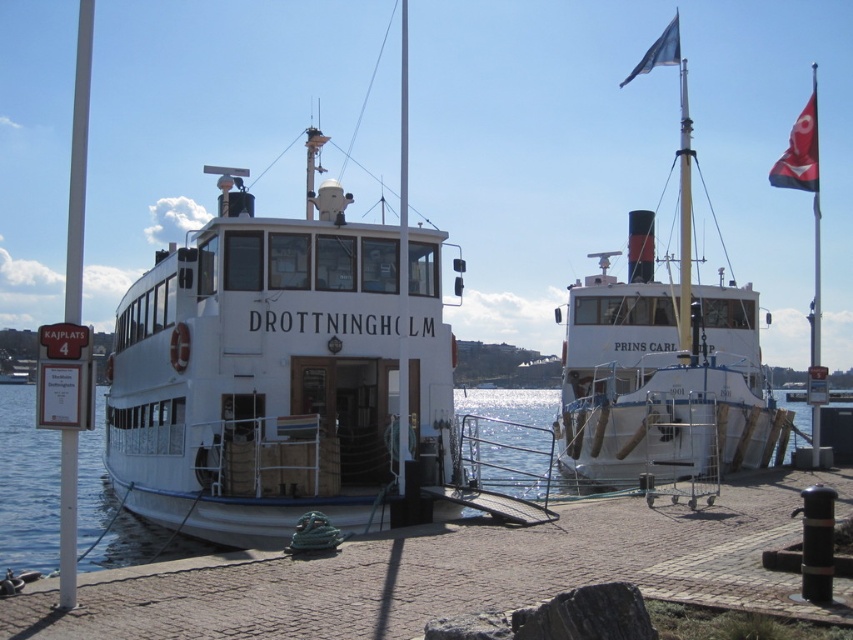
You are a dock worker who needs to secure both the white matte ship at right and the white matte pole at left. Which object requires a longer securing rope because of its size?

The white matte pole at left requires a longer securing rope because it is larger than the white matte ship at right.

You are a sailor planning to dock your 10m wide boat. You see the white matte ship at right and the clear water at center in the image. Which location would allow your boat to fit comfortably?

The clear water at center has a greater width than the white matte ship at right, so your 10m wide boat would fit better in the clear water at center.